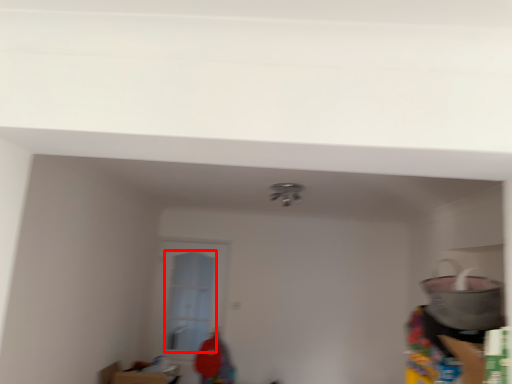
Question: From the image's perspective, what is the correct spatial relationship of glass door (annotated by the red box) in relation to appliance?

Choices:
 (A) above
 (B) below

Answer: (B)